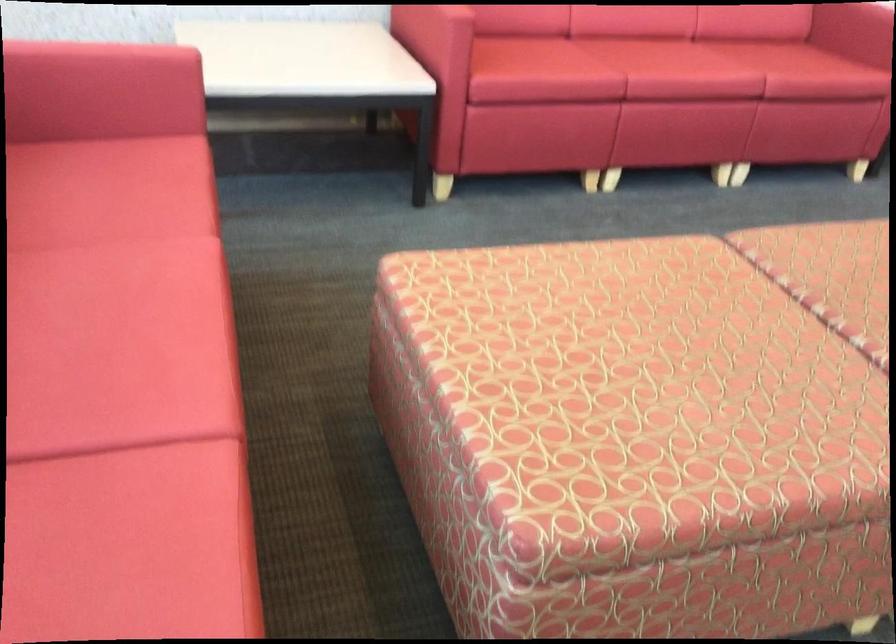
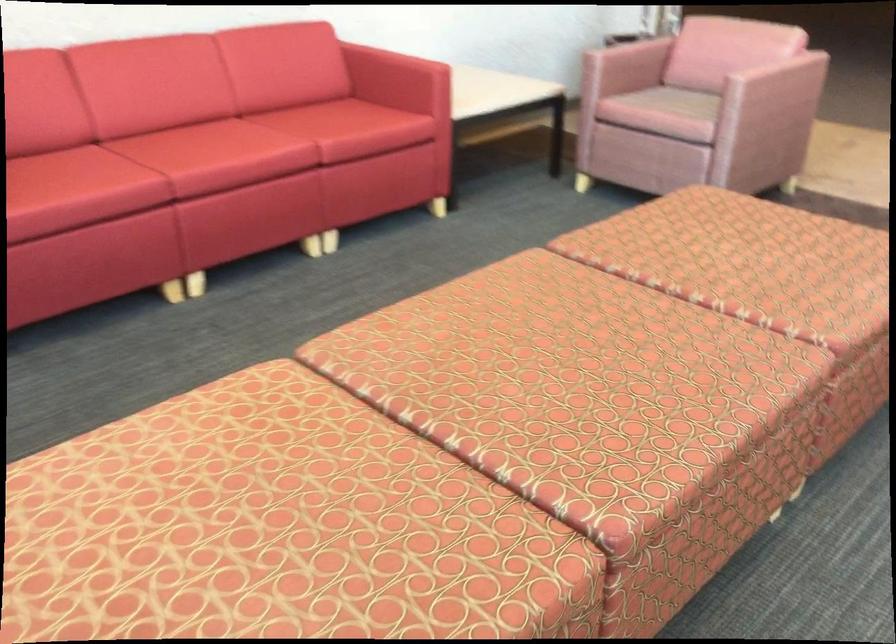
In the second image, find the point that corresponds to point 682,339 in the first image.

(250, 522)